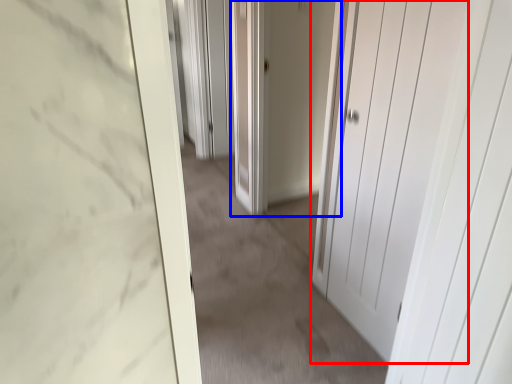
Question: Which object appears farthest to the camera in this image, door (highlighted by a red box) or door (highlighted by a blue box)?

Choices:
 (A) door
 (B) door

Answer: (B)